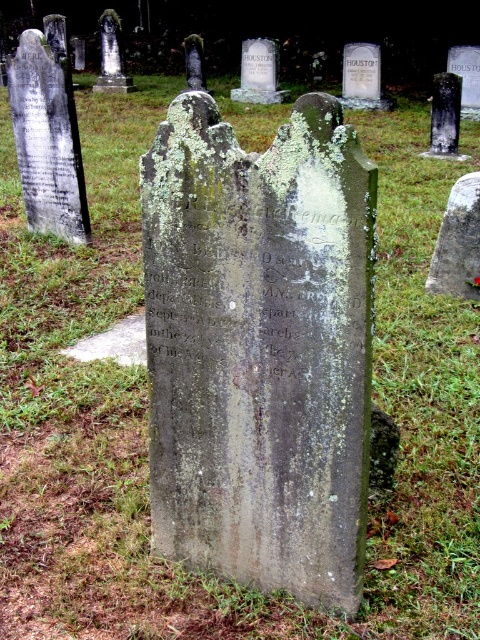
Does gray stone gravestone at center have a greater width compared to green mossy stone at center?

Indeed, gray stone gravestone at center has a greater width compared to green mossy stone at center.

Can you confirm if gray stone gravestone at center is taller than green mossy stone at center?

Yes, gray stone gravestone at center is taller than green mossy stone at center.

Between point (320, 573) and point (471, 195), which one is positioned in front?

Point (320, 573)

This screenshot has width=480, height=640. I want to click on gray stone gravestone at center, so click(x=260, y=348).